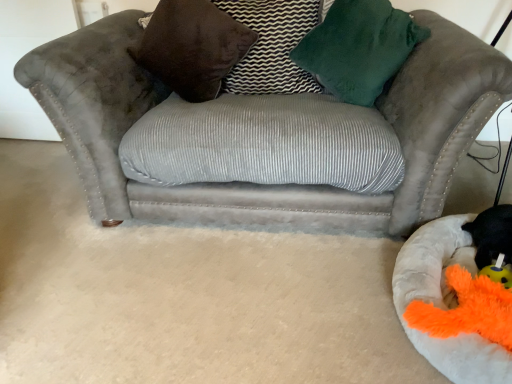
Question: Is fluffy white dog bed at lower right bigger or smaller than suede gray couch at center?

Choices:
 (A) big
 (B) small

Answer: (B)

Question: In terms of width, does fluffy white dog bed at lower right look wider or thinner when compared to suede gray couch at center?

Choices:
 (A) thin
 (B) wide

Answer: (A)

Question: Which is farther from the suede gray couch at center?

Choices:
 (A) velvet brown pillow at center, acting as the 1th pillow starting from the right
 (B) orange fuzzy toy at lower right
 (C) black plush toy at lower right
 (D) green velvet throw pillow at upper right
 (E) fluffy white dog bed at lower right

Answer: (B)

Question: Which object is positioned farthest from the velvet brown pillow at upper center, which ranks as the second pillow in right-to-left order?

Choices:
 (A) orange fuzzy toy at lower right
 (B) black plush toy at lower right
 (C) green velvet throw pillow at upper right
 (D) suede gray couch at center
 (E) fluffy white dog bed at lower right

Answer: (A)